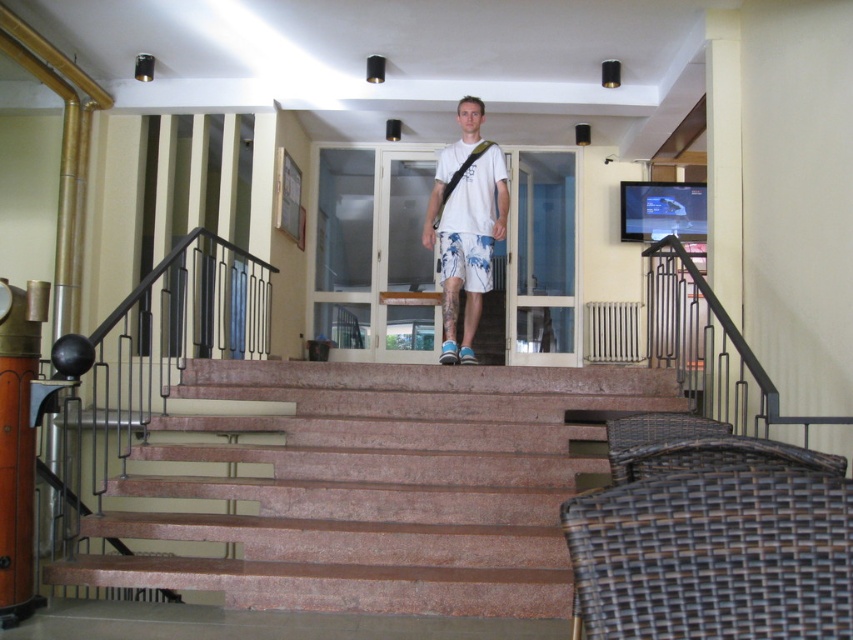
Question: Can you confirm if marble stairs at center is smaller than white floral shorts at center?

Choices:
 (A) no
 (B) yes

Answer: (A)

Question: Which point is farther from the camera taking this photo?

Choices:
 (A) (430, 234)
 (B) (482, 285)

Answer: (A)

Question: Which of the following is the farthest from the observer?

Choices:
 (A) (457, 262)
 (B) (395, 467)
 (C) (474, 211)

Answer: (C)

Question: Can you confirm if white cotton t-shirt at center is positioned below white floral shorts at center?

Choices:
 (A) no
 (B) yes

Answer: (A)

Question: Can you confirm if white cotton t-shirt at center is thinner than white floral shorts at center?

Choices:
 (A) no
 (B) yes

Answer: (A)

Question: Estimate the real-world distances between objects in this image. Which object is farther from the marble stairs at center?

Choices:
 (A) white floral shorts at center
 (B) white cotton t-shirt at center

Answer: (A)